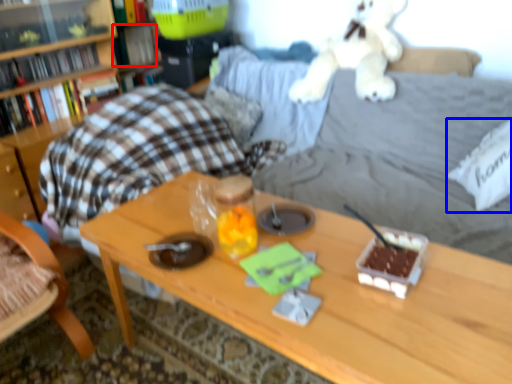
Question: Which of the following is the farthest to the observer, book (highlighted by a red box) or pillow (highlighted by a blue box)?

Choices:
 (A) book
 (B) pillow

Answer: (A)